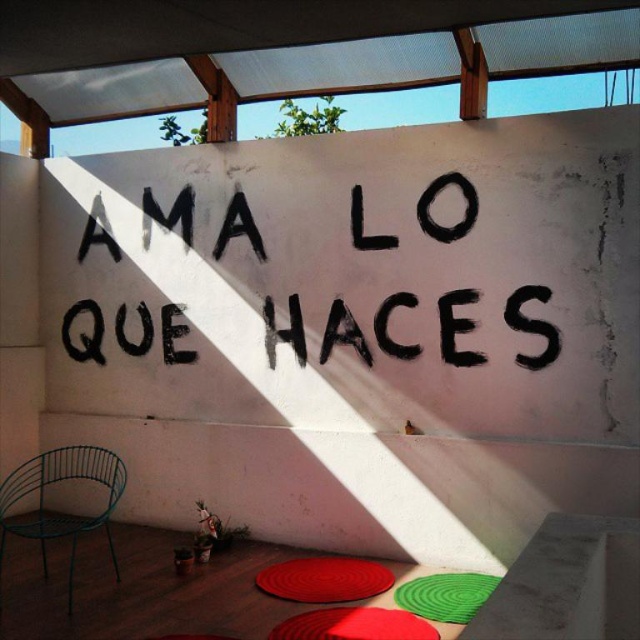
Does black paint sign at upper center appear on the right side of green wire chair at lower left?

Yes, black paint sign at upper center is to the right of green wire chair at lower left.

Which is in front, point (291, 193) or point (29, 476)?

Point (291, 193) is more forward.

Identify the location of black paint sign at upper center. (364, 276).

Which of these two, rubberized red circular mat at lower center or red rubber mat at lower center, stands shorter?

Standing shorter between the two is red rubber mat at lower center.

Looking at this image, does rubberized red circular mat at lower center have a larger size compared to red rubber mat at lower center?

Indeed, rubberized red circular mat at lower center has a larger size compared to red rubber mat at lower center.

The image size is (640, 640). In order to click on rubberized red circular mat at lower center in this screenshot , I will do `click(324, 579)`.

At what (x,y) coordinates should I click in order to perform the action: click on rubberized red circular mat at lower center. Please return your answer as a coordinate pair (x, y). This screenshot has height=640, width=640. Looking at the image, I should click on (324, 579).

Does point (13, 497) come in front of point (307, 611)?

No, it is behind (307, 611).

Is point (102, 461) more distant than point (326, 616)?

Yes, it is behind point (326, 616).

This screenshot has width=640, height=640. I want to click on green wire chair at lower left, so click(56, 513).